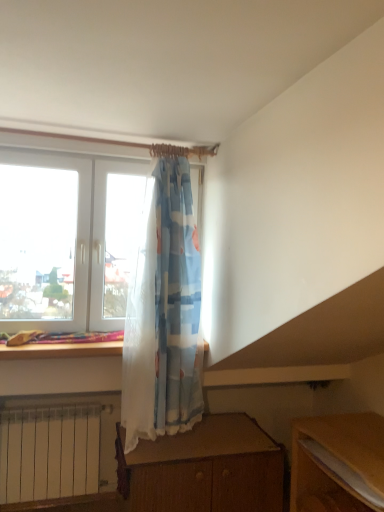
This screenshot has width=384, height=512. I want to click on wooden desk at lower center, so click(x=204, y=469).

What do you see at coordinates (204, 469) in the screenshot? I see `wooden desk at lower center` at bounding box center [204, 469].

Where is `wooden table at lower right`? The width and height of the screenshot is (384, 512). wooden table at lower right is located at coordinates (337, 462).

Describe the element at coordinates (337, 462) in the screenshot. I see `wooden table at lower right` at that location.

Where is `wooden desk at lower center`? This screenshot has height=512, width=384. wooden desk at lower center is located at coordinates (204, 469).

Is wooden desk at lower center at the right side of wooden table at lower right?

No, wooden desk at lower center is not to the right of wooden table at lower right.

Is wooden desk at lower center positioned in front of wooden table at lower right?

No, wooden desk at lower center is further to the viewer.

Considering the positions of point (224, 428) and point (352, 500), is point (224, 428) closer or farther from the camera than point (352, 500)?

Clearly, point (224, 428) is more distant from the camera than point (352, 500).

From the image's perspective, is wooden desk at lower center under wooden table at lower right?

Yes, from the image's perspective, wooden desk at lower center is beneath wooden table at lower right.

From a real-world perspective, which object stands above the other?

wooden table at lower right is physically above.

Is wooden desk at lower center wider or thinner than wooden table at lower right?

Considering their sizes, wooden desk at lower center looks broader than wooden table at lower right.

Between wooden desk at lower center and wooden table at lower right, which one has more height?

wooden desk at lower center is taller.

Considering the sizes of wooden desk at lower center and wooden table at lower right in the image, is wooden desk at lower center bigger or smaller than wooden table at lower right?

Considering their sizes, wooden desk at lower center takes up more space than wooden table at lower right.

Would you say wooden desk at lower center contains wooden table at lower right?

No, wooden table at lower right is not inside wooden desk at lower center.

Are wooden desk at lower center and wooden table at lower right located far from each other?

Actually, wooden desk at lower center and wooden table at lower right are a little close together.

Is wooden desk at lower center facing towards wooden table at lower right?

Yes, wooden desk at lower center is aimed at wooden table at lower right.

You are a GUI agent. You are given a task and a screenshot of the screen. Output one action in this format:
    pyautogui.click(x=<x>, y=<y>)
    Task: Click on the desk below the wooden table at lower right (from a real-world perspective)
    The width and height of the screenshot is (384, 512).
    Given the screenshot: What is the action you would take?
    pyautogui.click(x=204, y=469)

Is wooden table at lower right at the left side of wooden desk at lower center?

No.

Considering the positions of objects wooden table at lower right and wooden desk at lower center in the image provided, who is in front, wooden table at lower right or wooden desk at lower center?

wooden table at lower right is more forward.

Is point (364, 500) closer to viewer compared to point (152, 492)?

Yes.

From the image's perspective, is wooden table at lower right under wooden desk at lower center?

Actually, wooden table at lower right appears above wooden desk at lower center in the image.

From a real-world perspective, between wooden table at lower right and wooden desk at lower center, who is vertically higher?

wooden table at lower right.

Looking at their sizes, would you say wooden table at lower right is wider or thinner than wooden desk at lower center?

Clearly, wooden table at lower right has less width compared to wooden desk at lower center.

Considering the relative sizes of wooden table at lower right and wooden desk at lower center in the image provided, is wooden table at lower right shorter than wooden desk at lower center?

Yes.

Between wooden table at lower right and wooden desk at lower center, which one has smaller size?

With smaller size is wooden table at lower right.

Is wooden table at lower right inside the boundaries of wooden desk at lower center, or outside?

The correct answer is: outside.

Is wooden table at lower right next to wooden desk at lower center?

There is a gap between wooden table at lower right and wooden desk at lower center.

Is wooden table at lower right oriented away from wooden desk at lower center?

No, wooden table at lower right's orientation is not away from wooden desk at lower center.

In order to click on table in front of the wooden desk at lower center in this screenshot , I will do `click(337, 462)`.

At what (x,y) coordinates should I click in order to perform the action: click on desk that appears below the wooden table at lower right (from a real-world perspective). Please return your answer as a coordinate pair (x, y). Looking at the image, I should click on (204, 469).

At what (x,y) coordinates should I click in order to perform the action: click on table in front of the wooden desk at lower center. Please return your answer as a coordinate pair (x, y). This screenshot has width=384, height=512. Looking at the image, I should click on (337, 462).